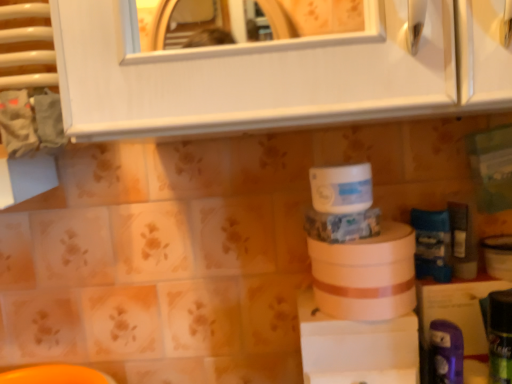
Where is `purple plastic toothbrush at lower right, the 3th toiletry viewed from the back`? purple plastic toothbrush at lower right, the 3th toiletry viewed from the back is located at coordinates (445, 353).

This screenshot has height=384, width=512. What do you see at coordinates (432, 244) in the screenshot?
I see `blue matte toothpaste tube at right, the 1th toiletry in the back-to-front sequence` at bounding box center [432, 244].

Describe the element at coordinates (462, 240) in the screenshot. This screenshot has width=512, height=384. I see `blue plastic tube at right, which is counted as the 2th toiletry, starting from the back` at that location.

Describe the element at coordinates (341, 188) in the screenshot. The image size is (512, 384). I see `white matte jar at center, the 2th toilet paper positioned from the bottom` at that location.

The image size is (512, 384). What do you see at coordinates (500, 336) in the screenshot?
I see `green matte can at lower right, the first toiletry viewed from the front` at bounding box center [500, 336].

Locate an element on the screen. white matte toilet paper at center, which is counted as the second toilet paper, starting from the top is located at coordinates (366, 275).

From the image's perspective, which one is positioned higher, purple plastic toothbrush at lower right, the 3th toiletry viewed from the back, or green matte can at lower right, the 4th toiletry from the back?

From the image's view, green matte can at lower right, the 4th toiletry from the back, is above.

Is purple plastic toothbrush at lower right, which appears as the 2th toiletry when viewed from the front, touching green matte can at lower right, the first toiletry viewed from the front?

Yes, purple plastic toothbrush at lower right, which appears as the 2th toiletry when viewed from the front, is beside green matte can at lower right, the first toiletry viewed from the front.

Is purple plastic toothbrush at lower right, which appears as the 2th toiletry when viewed from the front, turned away from green matte can at lower right, the first toiletry viewed from the front?

No.

Considering the relative sizes of purple plastic toothbrush at lower right, the 3th toiletry viewed from the back, and green matte can at lower right, the first toiletry viewed from the front, in the image provided, is purple plastic toothbrush at lower right, the 3th toiletry viewed from the back, wider than green matte can at lower right, the first toiletry viewed from the front,?

In fact, purple plastic toothbrush at lower right, the 3th toiletry viewed from the back, might be narrower than green matte can at lower right, the first toiletry viewed from the front.

Which of these two, blue plastic tube at right, which is counted as the 2th toiletry, starting from the back, or blue matte toothpaste tube at right, the 1th toiletry in the back-to-front sequence, stands shorter?

blue matte toothpaste tube at right, the 1th toiletry in the back-to-front sequence, is shorter.

Considering the positions of objects blue plastic tube at right, which is counted as the 2th toiletry, starting from the back, and blue matte toothpaste tube at right, which ranks as the fourth toiletry in front-to-back order, in the image provided, who is in front, blue plastic tube at right, which is counted as the 2th toiletry, starting from the back, or blue matte toothpaste tube at right, which ranks as the fourth toiletry in front-to-back order,?

blue plastic tube at right, which is counted as the 2th toiletry, starting from the back, is closer to the camera.

In the scene shown: Considering the relative sizes of blue plastic tube at right, which is counted as the 2th toiletry, starting from the back, and blue matte toothpaste tube at right, the 1th toiletry in the back-to-front sequence, in the image provided, is blue plastic tube at right, which is counted as the 2th toiletry, starting from the back, wider than blue matte toothpaste tube at right, the 1th toiletry in the back-to-front sequence,?

No.

Which of these two, blue plastic tube at right, placed as the third toiletry when sorted from front to back, or blue matte toothpaste tube at right, the 1th toiletry in the back-to-front sequence, is smaller?

Smaller between the two is blue plastic tube at right, placed as the third toiletry when sorted from front to back.

Choose the correct answer: Is blue matte toothpaste tube at right, the 1th toiletry in the back-to-front sequence, inside white matte jar at center, the first toilet paper viewed from the top, or outside it?

blue matte toothpaste tube at right, the 1th toiletry in the back-to-front sequence, is not enclosed by white matte jar at center, the first toilet paper viewed from the top.

Who is taller, blue matte toothpaste tube at right, the 1th toiletry in the back-to-front sequence, or white matte jar at center, the first toilet paper viewed from the top?

blue matte toothpaste tube at right, the 1th toiletry in the back-to-front sequence, is taller.

I want to click on toiletry that is the 3rd one when counting backward from the white matte jar at center, the first toilet paper viewed from the top, so (x=432, y=244).

Considering the sizes of objects white matte toilet paper at center, which is counted as the second toilet paper, starting from the top, and white matte jar at center, the 2th toilet paper positioned from the bottom, in the image provided, who is wider, white matte toilet paper at center, which is counted as the second toilet paper, starting from the top, or white matte jar at center, the 2th toilet paper positioned from the bottom,?

Wider between the two is white matte toilet paper at center, which is counted as the second toilet paper, starting from the top.

Measure the distance from white matte toilet paper at center, which is counted as the second toilet paper, starting from the top, to white matte jar at center, the first toilet paper viewed from the top.

white matte toilet paper at center, which is counted as the second toilet paper, starting from the top, and white matte jar at center, the first toilet paper viewed from the top, are 3.75 inches apart.

Locate an element on the screen. The image size is (512, 384). toilet paper behind the white matte jar at center, the first toilet paper viewed from the top is located at coordinates (366, 275).

Considering the sizes of objects white matte toilet paper at center, acting as the 1th toilet paper starting from the bottom, and blue plastic tube at right, placed as the third toiletry when sorted from front to back, in the image provided, who is thinner, white matte toilet paper at center, acting as the 1th toilet paper starting from the bottom, or blue plastic tube at right, placed as the third toiletry when sorted from front to back,?

With smaller width is blue plastic tube at right, placed as the third toiletry when sorted from front to back.

Between white matte toilet paper at center, which is counted as the second toilet paper, starting from the top, and blue plastic tube at right, placed as the third toiletry when sorted from front to back, which one is positioned behind?

Positioned behind is blue plastic tube at right, placed as the third toiletry when sorted from front to back.

You are a GUI agent. You are given a task and a screenshot of the screen. Output one action in this format:
    pyautogui.click(x=<x>, y=<y>)
    Task: Click on the toilet paper below the blue plastic tube at right, which is counted as the 2th toiletry, starting from the back (from the image's perspective)
    This screenshot has height=384, width=512.
    Given the screenshot: What is the action you would take?
    pyautogui.click(x=366, y=275)

Looking at this image, would you consider white matte toilet paper at center, which is counted as the second toilet paper, starting from the top, to be distant from blue plastic tube at right, which is counted as the 2th toiletry, starting from the back?

No, white matte toilet paper at center, which is counted as the second toilet paper, starting from the top, is not far away from blue plastic tube at right, which is counted as the 2th toiletry, starting from the back.

Considering the relative sizes of white matte jar at center, the first toilet paper viewed from the top, and purple plastic toothbrush at lower right, which appears as the 2th toiletry when viewed from the front, in the image provided, is white matte jar at center, the first toilet paper viewed from the top, thinner than purple plastic toothbrush at lower right, which appears as the 2th toiletry when viewed from the front,?

No.

Is the position of white matte jar at center, the first toilet paper viewed from the top, more distant than that of purple plastic toothbrush at lower right, which appears as the 2th toiletry when viewed from the front?

No, white matte jar at center, the first toilet paper viewed from the top, is in front of purple plastic toothbrush at lower right, which appears as the 2th toiletry when viewed from the front.

Would you say white matte jar at center, the first toilet paper viewed from the top, is to the left or to the right of purple plastic toothbrush at lower right, the 3th toiletry viewed from the back, in the picture?

From the image, it's evident that white matte jar at center, the first toilet paper viewed from the top, is to the left of purple plastic toothbrush at lower right, the 3th toiletry viewed from the back.

Considering the relative sizes of white matte jar at center, the first toilet paper viewed from the top, and purple plastic toothbrush at lower right, which appears as the 2th toiletry when viewed from the front, in the image provided, is white matte jar at center, the first toilet paper viewed from the top, shorter than purple plastic toothbrush at lower right, which appears as the 2th toiletry when viewed from the front,?

Yes, white matte jar at center, the first toilet paper viewed from the top, is shorter than purple plastic toothbrush at lower right, which appears as the 2th toiletry when viewed from the front.

How far apart are purple plastic toothbrush at lower right, which appears as the 2th toiletry when viewed from the front, and blue matte toothpaste tube at right, which ranks as the fourth toiletry in front-to-back order?

purple plastic toothbrush at lower right, which appears as the 2th toiletry when viewed from the front, and blue matte toothpaste tube at right, which ranks as the fourth toiletry in front-to-back order, are 5.33 inches apart.

Between purple plastic toothbrush at lower right, which appears as the 2th toiletry when viewed from the front, and blue matte toothpaste tube at right, the 1th toiletry in the back-to-front sequence, which one appears on the right side from the viewer's perspective?

Positioned to the right is blue matte toothpaste tube at right, the 1th toiletry in the back-to-front sequence.

Is purple plastic toothbrush at lower right, which appears as the 2th toiletry when viewed from the front, next to blue matte toothpaste tube at right, which ranks as the fourth toiletry in front-to-back order, and touching it?

No, purple plastic toothbrush at lower right, which appears as the 2th toiletry when viewed from the front, is not next to blue matte toothpaste tube at right, which ranks as the fourth toiletry in front-to-back order.

Considering the sizes of objects purple plastic toothbrush at lower right, which appears as the 2th toiletry when viewed from the front, and blue matte toothpaste tube at right, which ranks as the fourth toiletry in front-to-back order, in the image provided, who is taller, purple plastic toothbrush at lower right, which appears as the 2th toiletry when viewed from the front, or blue matte toothpaste tube at right, which ranks as the fourth toiletry in front-to-back order,?

Standing taller between the two is blue matte toothpaste tube at right, which ranks as the fourth toiletry in front-to-back order.

There is a purple plastic toothbrush at lower right, which appears as the 2th toiletry when viewed from the front. Identify the location of the 1st toiletry above it (from a real-world perspective). Image resolution: width=512 pixels, height=384 pixels. (500, 336).

The width and height of the screenshot is (512, 384). Find the location of `the 1st toiletry below the blue plastic tube at right, placed as the third toiletry when sorted from front to back (from a real-world perspective)`. the 1st toiletry below the blue plastic tube at right, placed as the third toiletry when sorted from front to back (from a real-world perspective) is located at coordinates (432, 244).

Consider the image. Looking at the image, which one is located further to blue plastic tube at right, which is counted as the 2th toiletry, starting from the back, green matte can at lower right, the first toiletry viewed from the front, or purple plastic toothbrush at lower right, the 3th toiletry viewed from the back?

The object further to blue plastic tube at right, which is counted as the 2th toiletry, starting from the back, is purple plastic toothbrush at lower right, the 3th toiletry viewed from the back.

Considering their positions, is blue plastic tube at right, placed as the third toiletry when sorted from front to back, positioned further to white matte toilet paper at center, which is counted as the second toilet paper, starting from the top, than white matte jar at center, the 2th toilet paper positioned from the bottom?

blue plastic tube at right, placed as the third toiletry when sorted from front to back, is positioned further to the anchor white matte toilet paper at center, which is counted as the second toilet paper, starting from the top.

Looking at the image, which one is located further to blue matte toothpaste tube at right, which ranks as the fourth toiletry in front-to-back order, purple plastic toothbrush at lower right, the 3th toiletry viewed from the back, or white matte jar at center, the 2th toilet paper positioned from the bottom?

white matte jar at center, the 2th toilet paper positioned from the bottom, lies further to blue matte toothpaste tube at right, which ranks as the fourth toiletry in front-to-back order, than the other object.

Which object lies further to the anchor point white matte toilet paper at center, acting as the 1th toilet paper starting from the bottom, purple plastic toothbrush at lower right, the 3th toiletry viewed from the back, or green matte can at lower right, the first toiletry viewed from the front?

green matte can at lower right, the first toiletry viewed from the front.

From the image, which object appears to be farther from white matte toilet paper at center, which is counted as the second toilet paper, starting from the top, green matte can at lower right, the first toiletry viewed from the front, or white matte jar at center, the first toilet paper viewed from the top?

Based on the image, green matte can at lower right, the first toiletry viewed from the front, appears to be further to white matte toilet paper at center, which is counted as the second toilet paper, starting from the top.

Looking at the image, which one is located further to blue plastic tube at right, placed as the third toiletry when sorted from front to back, green matte can at lower right, the first toiletry viewed from the front, or white matte toilet paper at center, which is counted as the second toilet paper, starting from the top?

white matte toilet paper at center, which is counted as the second toilet paper, starting from the top, is further to blue plastic tube at right, placed as the third toiletry when sorted from front to back.

Looking at the image, which one is located further to green matte can at lower right, the 4th toiletry from the back, blue matte toothpaste tube at right, the 1th toiletry in the back-to-front sequence, or white matte toilet paper at center, which is counted as the second toilet paper, starting from the top?

white matte toilet paper at center, which is counted as the second toilet paper, starting from the top, lies further to green matte can at lower right, the 4th toiletry from the back, than the other object.

Looking at the image, which one is located further to blue plastic tube at right, which is counted as the 2th toiletry, starting from the back, blue matte toothpaste tube at right, which ranks as the fourth toiletry in front-to-back order, or white matte jar at center, the first toilet paper viewed from the top?

white matte jar at center, the first toilet paper viewed from the top.

Locate an element on the screen. This screenshot has height=384, width=512. toiletry that lies between blue plastic tube at right, placed as the third toiletry when sorted from front to back, and green matte can at lower right, the 4th toiletry from the back, from top to bottom is located at coordinates (432, 244).

What are the coordinates of `toilet paper that lies between blue matte toothpaste tube at right, the 1th toiletry in the back-to-front sequence, and purple plastic toothbrush at lower right, the 3th toiletry viewed from the back, from top to bottom` in the screenshot? It's located at (366, 275).

This screenshot has width=512, height=384. Identify the location of toilet paper between white matte jar at center, the first toilet paper viewed from the top, and green matte can at lower right, the first toiletry viewed from the front. pos(366,275).

This screenshot has width=512, height=384. In order to click on toilet paper between white matte jar at center, the first toilet paper viewed from the top, and blue plastic tube at right, which is counted as the 2th toiletry, starting from the back, in the horizontal direction in this screenshot , I will do `click(366, 275)`.